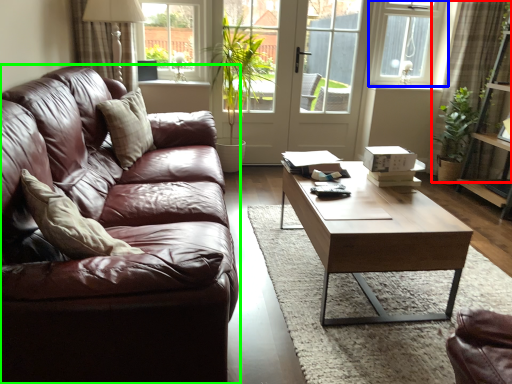
Question: Estimate the real-world distances between objects in this image. Which object is closer to curtain (highlighted by a red box), window (highlighted by a blue box) or studio couch (highlighted by a green box)?

Choices:
 (A) window
 (B) studio couch

Answer: (A)